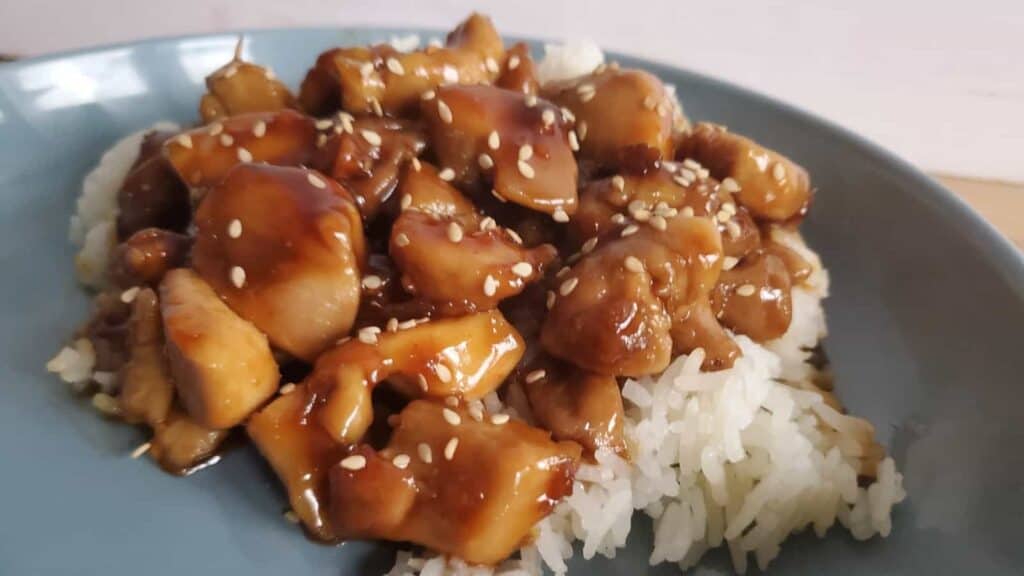
Where is `reflection of light on the plate`? reflection of light on the plate is located at coordinates (96, 90).